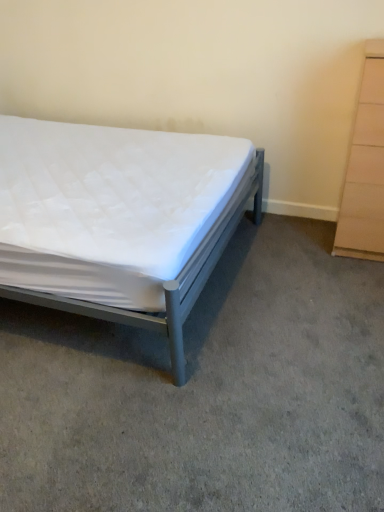
Question: Is metallic gray bed at left to the left of beige wood chest of drawers at right from the viewer's perspective?

Choices:
 (A) no
 (B) yes

Answer: (B)

Question: Is metallic gray bed at left next to beige wood chest of drawers at right and touching it?

Choices:
 (A) yes
 (B) no

Answer: (B)

Question: Is metallic gray bed at left oriented away from beige wood chest of drawers at right?

Choices:
 (A) no
 (B) yes

Answer: (A)

Question: From the image's perspective, is metallic gray bed at left under beige wood chest of drawers at right?

Choices:
 (A) no
 (B) yes

Answer: (B)

Question: Is metallic gray bed at left not near beige wood chest of drawers at right?

Choices:
 (A) no
 (B) yes

Answer: (B)

Question: From a real-world perspective, is metallic gray bed at left under beige wood chest of drawers at right?

Choices:
 (A) yes
 (B) no

Answer: (A)

Question: Does beige wood chest of drawers at right have a smaller size compared to metallic gray bed at left?

Choices:
 (A) yes
 (B) no

Answer: (A)

Question: Is metallic gray bed at left a part of beige wood chest of drawers at right?

Choices:
 (A) no
 (B) yes

Answer: (A)

Question: From the image's perspective, is beige wood chest of drawers at right beneath metallic gray bed at left?

Choices:
 (A) yes
 (B) no

Answer: (B)

Question: From the image's perspective, is beige wood chest of drawers at right located above metallic gray bed at left?

Choices:
 (A) no
 (B) yes

Answer: (B)

Question: Considering the relative sizes of beige wood chest of drawers at right and metallic gray bed at left in the image provided, is beige wood chest of drawers at right bigger than metallic gray bed at left?

Choices:
 (A) yes
 (B) no

Answer: (B)

Question: Is beige wood chest of drawers at right at the right side of metallic gray bed at left?

Choices:
 (A) yes
 (B) no

Answer: (A)

Question: Can you see beige wood chest of drawers at right touching white quilted mattress at center?

Choices:
 (A) no
 (B) yes

Answer: (A)